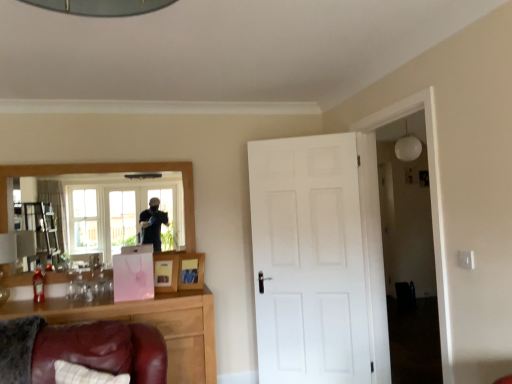
Question: Is pink paper picture frame at center, positioned as the second picture frame in right-to-left order, spatially inside white matte light fixture at upper right, or outside of it?

Choices:
 (A) inside
 (B) outside

Answer: (B)

Question: Looking at their shapes, would you say pink paper picture frame at center, positioned as the second picture frame in right-to-left order, is wider or thinner than white matte light fixture at upper right?

Choices:
 (A) thin
 (B) wide

Answer: (A)

Question: Which object is positioned farthest from the pink paper picture frame at center, the 1th picture frame from the left?

Choices:
 (A) brown wooden cabinet at lower left
 (B) white matte light fixture at upper right
 (C) white matte door at center
 (D) wooden photo frame at center, which is the second picture frame from left to right
 (E) wooden framed mirror at upper left

Answer: (B)

Question: Considering the real-world distances, which object is farthest from the white matte door at center?

Choices:
 (A) white matte light fixture at upper right
 (B) wooden framed mirror at upper left
 (C) pink paper picture frame at center, positioned as the second picture frame in right-to-left order
 (D) wooden photo frame at center, the first picture frame viewed from the right
 (E) brown wooden cabinet at lower left

Answer: (A)